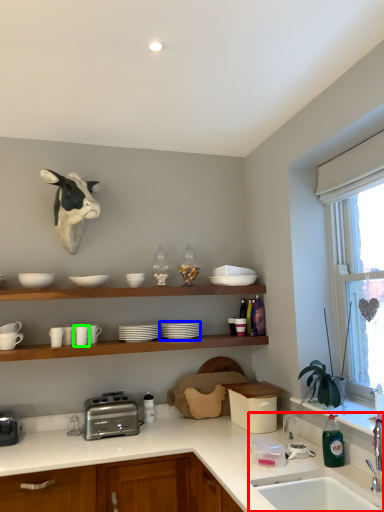
Question: Which object is the farthest from sink (highlighted by a red box)? Choose among these: tableware (highlighted by a blue box) or tableware (highlighted by a green box).

Choices:
 (A) tableware
 (B) tableware

Answer: (B)